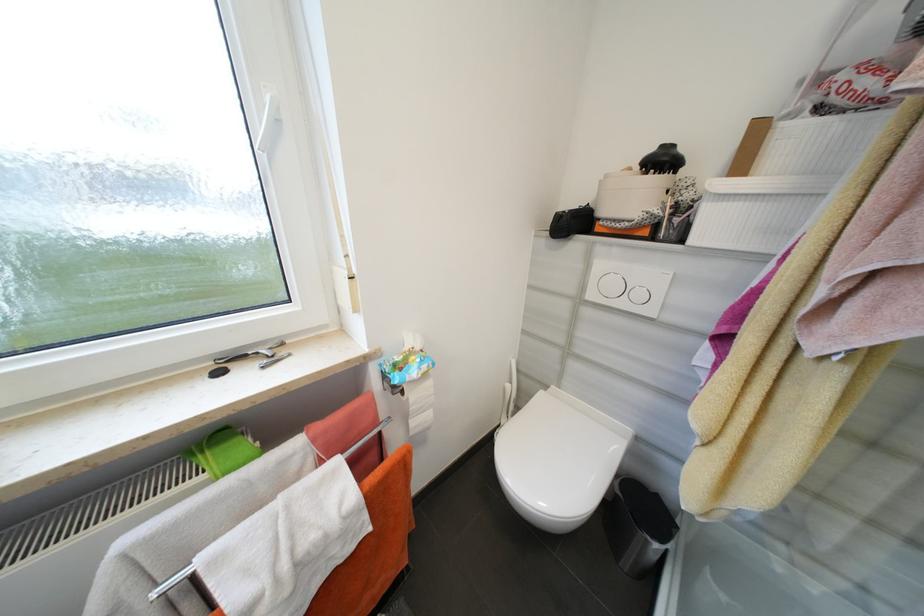
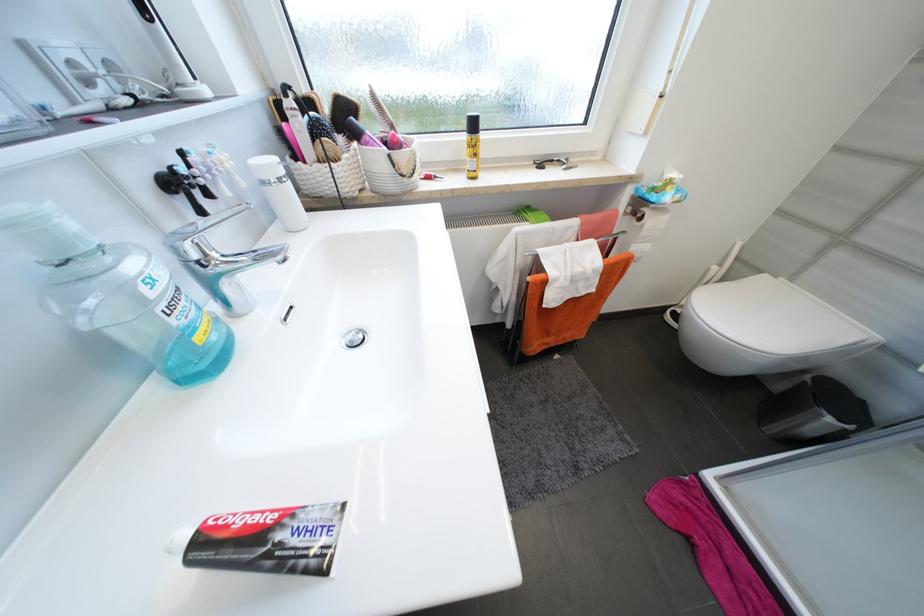
Find the pixel in the second image that matches point 407,392 in the first image.

(647, 219)